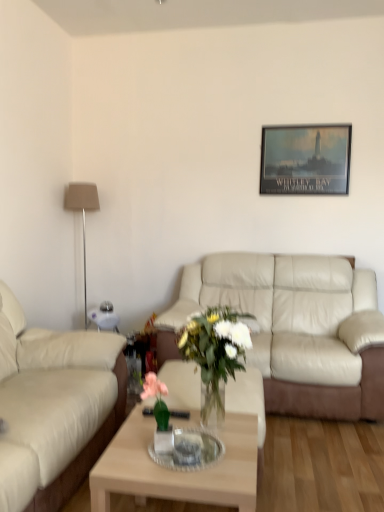
Question: In terms of size, does beige leather couch at left, the 1th studio couch from the left, appear bigger or smaller than beige leather couch at center, the second studio couch viewed from the left?

Choices:
 (A) small
 (B) big

Answer: (A)

Question: From their relative heights in the image, would you say beige leather couch at left, the 1th studio couch from the left, is taller or shorter than beige leather couch at center, which is counted as the first studio couch, starting from the back?

Choices:
 (A) short
 (B) tall

Answer: (B)

Question: Which of these objects is positioned farthest from the matte black poster at upper center?

Choices:
 (A) light wood/transparent glass coffee table at center
 (B) beige fabric lamp at left
 (C) beige leather couch at center, the second studio couch viewed from the left
 (D) clear glass tray at center
 (E) white glass vase at center

Answer: (D)

Question: Considering the real-world distances, which object is farthest from the light wood/transparent glass coffee table at center?

Choices:
 (A) beige leather couch at left, which is counted as the first studio couch, starting from the front
 (B) beige leather couch at center, which is counted as the first studio couch, starting from the back
 (C) beige fabric lamp at left
 (D) clear glass tray at center
 (E) white glass vase at center

Answer: (C)